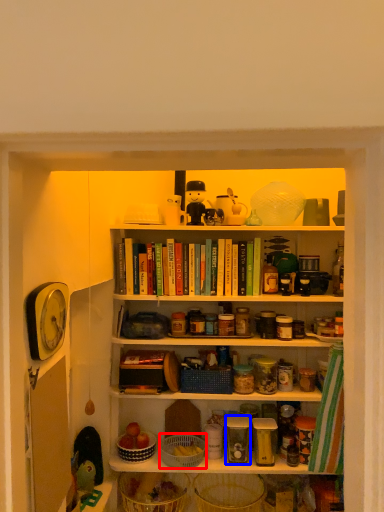
Question: Which of the following is the farthest to the observer, basket (highlighted by a red box) or glass jar (highlighted by a blue box)?

Choices:
 (A) basket
 (B) glass jar

Answer: (B)